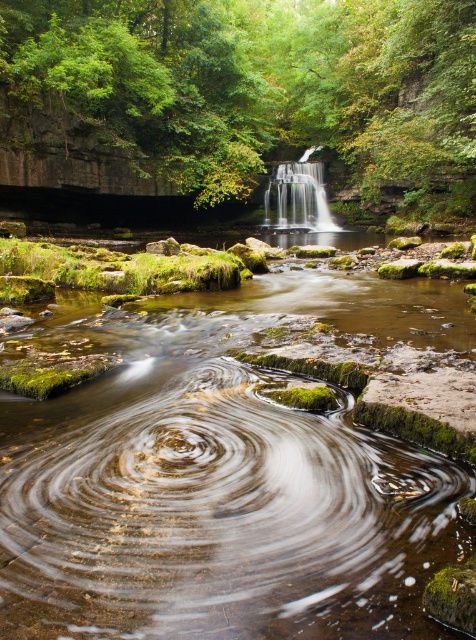
Question: Which of the following is the closest to the observer?

Choices:
 (A) green leafy forest at upper center
 (B) white silky waterfall at center

Answer: (A)

Question: Is green leafy forest at upper center behind white silky waterfall at center?

Choices:
 (A) no
 (B) yes

Answer: (A)

Question: Does green leafy forest at upper center appear on the left side of white silky waterfall at center?

Choices:
 (A) no
 (B) yes

Answer: (B)

Question: Among these points, which one is farthest from the camera?

Choices:
 (A) (268, 195)
 (B) (274, 147)

Answer: (B)

Question: Does green leafy forest at upper center appear on the right side of white silky waterfall at center?

Choices:
 (A) no
 (B) yes

Answer: (A)

Question: Which object is farther from the camera taking this photo?

Choices:
 (A) white silky waterfall at center
 (B) green leafy forest at upper center

Answer: (A)